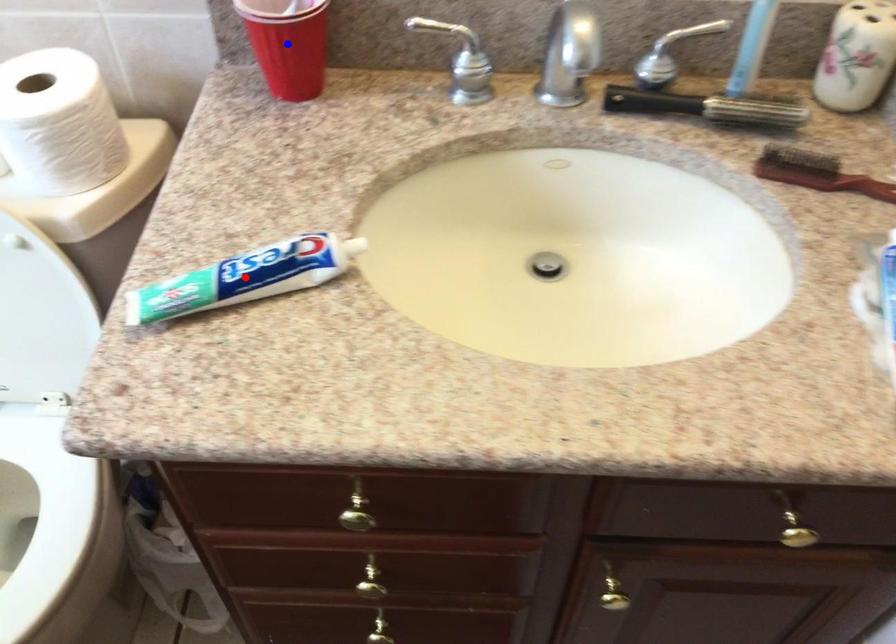
Question: In the image, two points are highlighted. Which point is nearer to the camera? Reply with the corresponding letter.

Choices:
 (A) blue point
 (B) red point

Answer: (B)